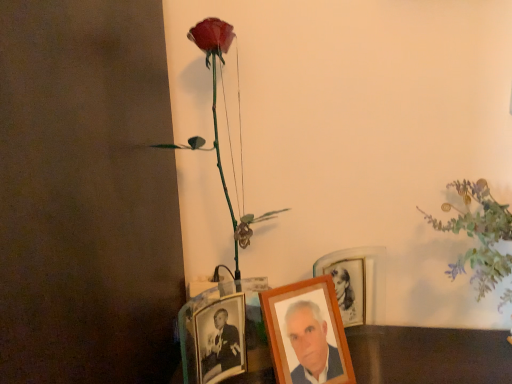
Question: Based on their sizes in the image, would you say wooden photo frame at center, the third picture frame when ordered from left to right, is bigger or smaller than metallic photo frame at lower center, positioned as the 1th picture frame in left-to-right order?

Choices:
 (A) big
 (B) small

Answer: (B)

Question: Considering the positions of wooden photo frame at center, the third picture frame when ordered from left to right, and metallic photo frame at lower center, placed as the third picture frame when sorted from right to left, in the image, is wooden photo frame at center, the third picture frame when ordered from left to right, taller or shorter than metallic photo frame at lower center, placed as the third picture frame when sorted from right to left,?

Choices:
 (A) tall
 (B) short

Answer: (B)

Question: Which object is positioned closest to the metallic photo frame at lower center, placed as the third picture frame when sorted from right to left?

Choices:
 (A) wooden photo frame at center, the second picture frame viewed from the right
 (B) shiny plastic rose at upper left, positioned as the first floral arrangement in left-to-right order
 (C) wooden photo frame at center, which appears as the 1th picture frame when viewed from the right
 (D) matte green plant at upper right, arranged as the 1th floral arrangement when viewed from the right

Answer: (A)

Question: Estimate the real-world distances between objects in this image. Which object is closer to the matte green plant at upper right, arranged as the 1th floral arrangement when viewed from the right?

Choices:
 (A) shiny plastic rose at upper left, positioned as the first floral arrangement in left-to-right order
 (B) wooden photo frame at center, which appears as the 1th picture frame when viewed from the right
 (C) metallic photo frame at lower center, placed as the third picture frame when sorted from right to left
 (D) wooden photo frame at center, the second picture frame viewed from the right

Answer: (B)